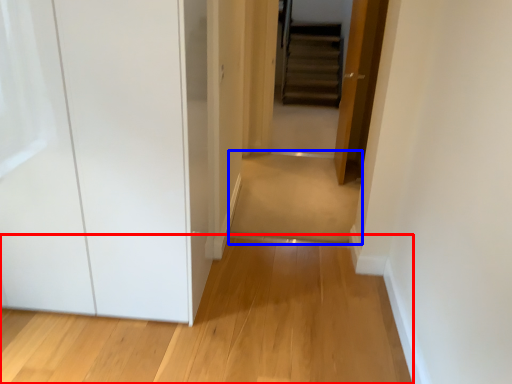
Question: Which point is further to the camera, path (highlighted by a red box) or path (highlighted by a blue box)?

Choices:
 (A) path
 (B) path

Answer: (B)